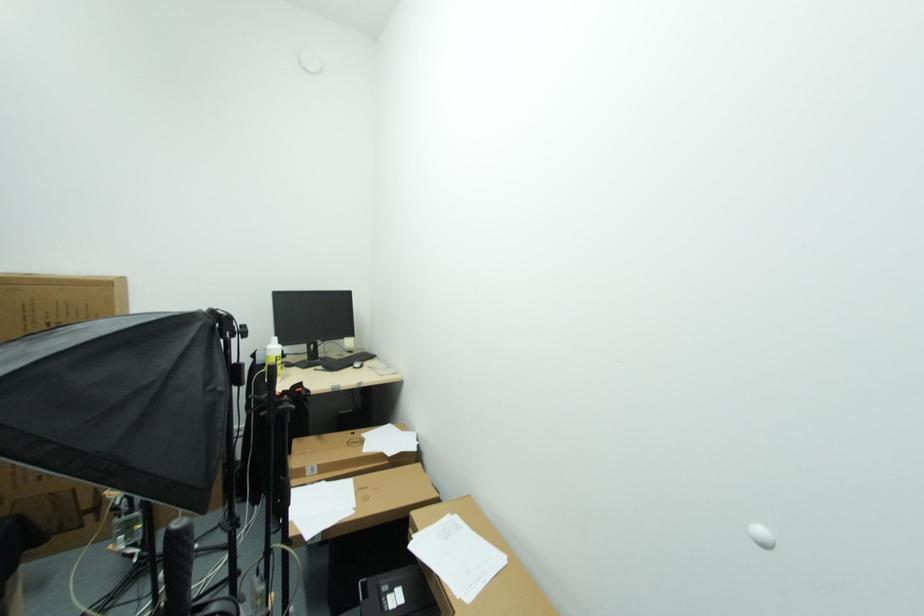
Locate an element on the screen. The height and width of the screenshot is (616, 924). silver adjustment knob is located at coordinates (761, 536).